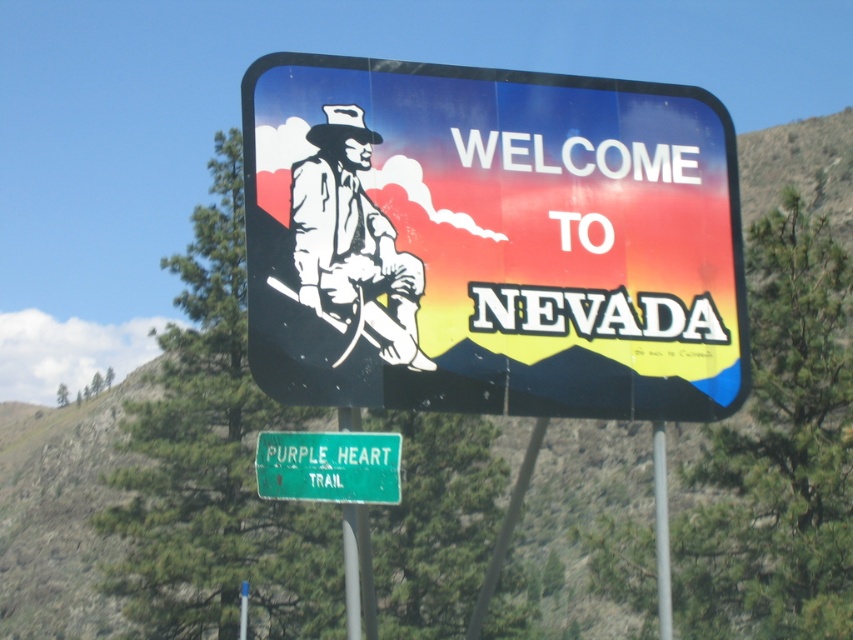
Question: Which point is farther to the camera?

Choices:
 (A) (434, 70)
 (B) (306, 492)
 (C) (350, 602)
 (D) (664, 458)

Answer: (D)

Question: Which point is closer to the camera?

Choices:
 (A) metallic gray pole at center
 (B) matte plastic signboard at center
 (C) white matte cowboy at center
 (D) green metal signpost at center

Answer: (D)

Question: Which of these objects is positioned closest to the green metal signpost at center?

Choices:
 (A) metallic gray pole at center
 (B) matte plastic signboard at center

Answer: (A)

Question: Does matte plastic signboard at center have a lesser width compared to white matte cowboy at center?

Choices:
 (A) no
 (B) yes

Answer: (B)

Question: Is green metallic sign at lower center wider than metallic gray pole at center?

Choices:
 (A) yes
 (B) no

Answer: (B)

Question: Is matte plastic signboard at center wider than green metal signpost at center?

Choices:
 (A) no
 (B) yes

Answer: (A)